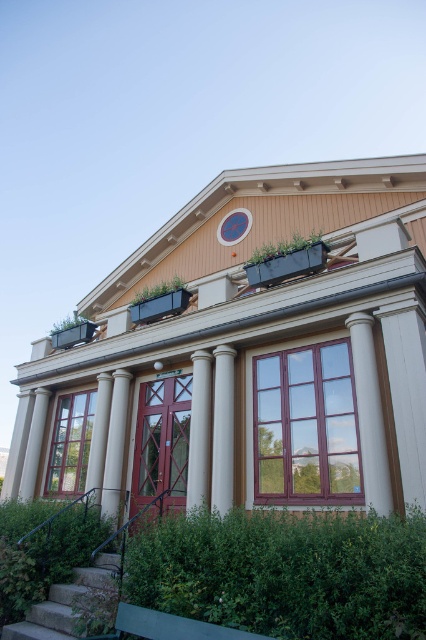
You are standing in front of the building and want to place a decorative statue exactly at the center of the green leafy hedge at lower center. According to the coordinates provided, what are the coordinates where you should place the statue?

The coordinates for the center of the green leafy hedge at lower center are exactly at point (x=284, y=572).

From the picture: You are standing at the entrance of the building and see two points marked on the facade. The first point is at coordinates point (360, 586) and the second is at point (8, 476). Which point is closer to your current position?

Point (360, 586) is in front of point (8, 476), so the first point is closer to your current position at the entrance.